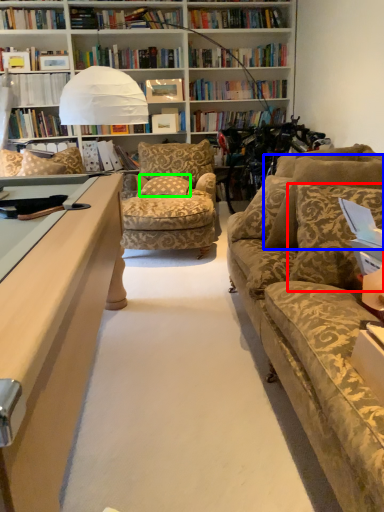
Question: Which is nearer to the pillow (highlighted by a red box)? pillow (highlighted by a blue box) or pillow (highlighted by a green box).

Choices:
 (A) pillow
 (B) pillow

Answer: (A)